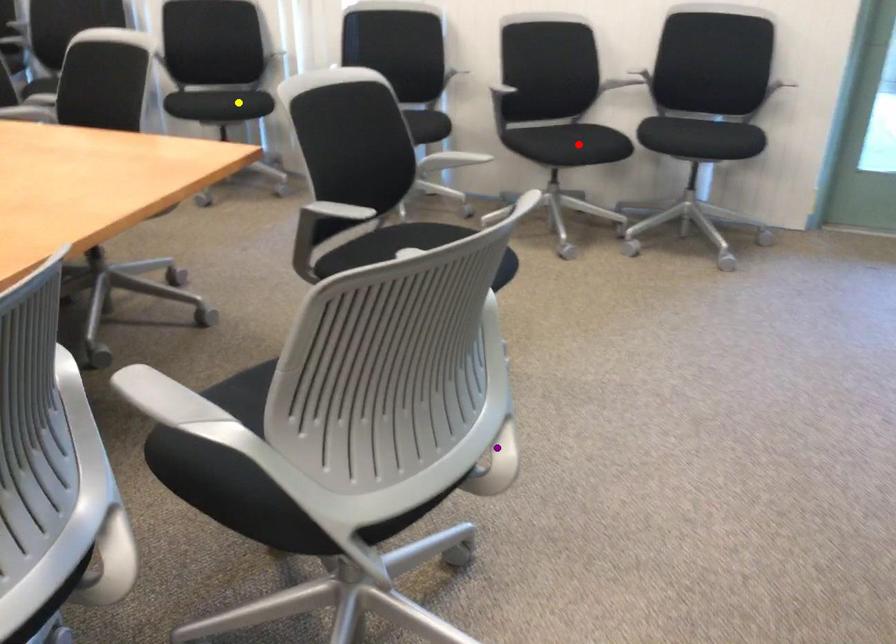
Order these from nearest to farthest:
A) yellow point
B) purple point
C) red point

purple point
red point
yellow point